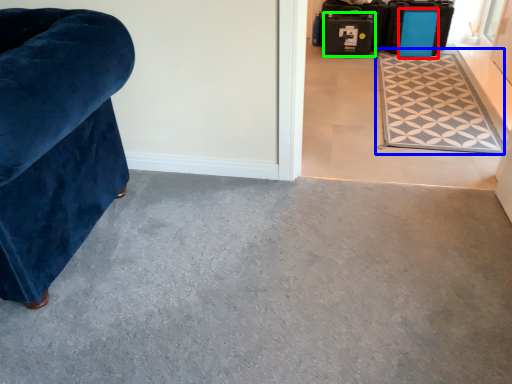
Question: Estimate the real-world distances between objects in this image. Which object is closer to luggage (highlighted by a red box), mat (highlighted by a blue box) or luggage (highlighted by a green box)?

Choices:
 (A) mat
 (B) luggage

Answer: (B)